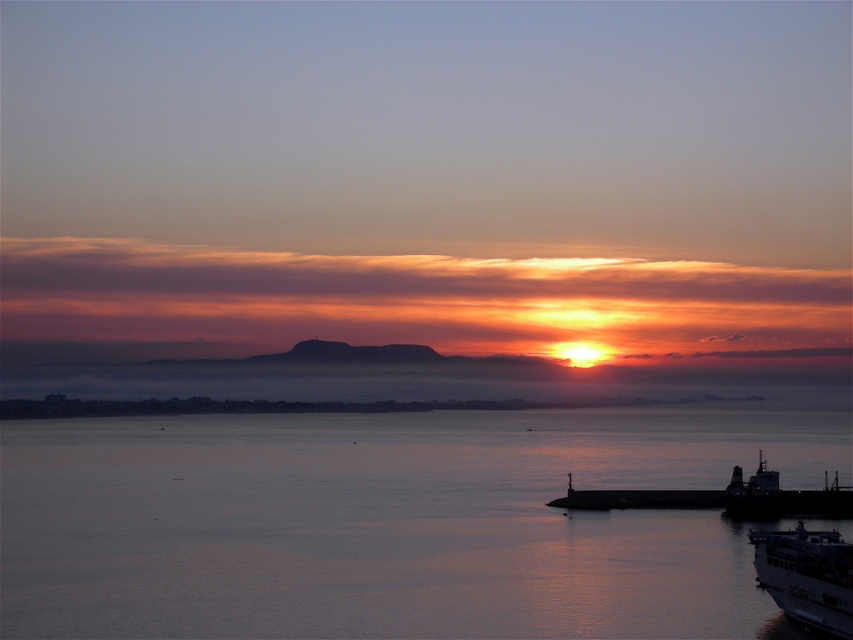
Based on the photo, you are a photographer planning to capture the sunset scene. You want to ensure that the smooth water at lower center and the metallic gray ship at lower right are both visible in your shot. Based on their sizes, which object should you frame to take up more space in the photo?

The smooth water at lower center should be framed to take up more space in the photo since its width is larger than the metallic gray ship at lower right.